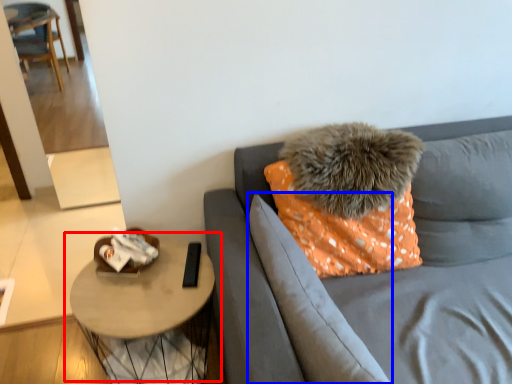
Question: Which object is further to the camera taking this photo, table (highlighted by a red box) or pillow (highlighted by a blue box)?

Choices:
 (A) table
 (B) pillow

Answer: (A)